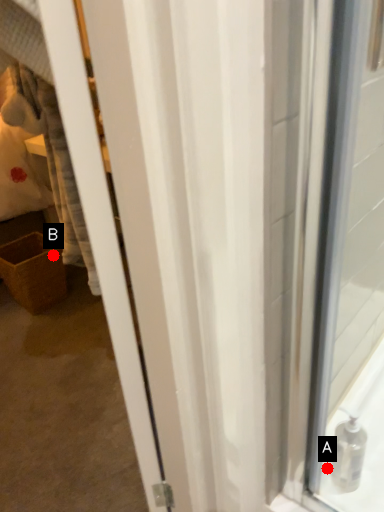
Question: Two points are circled on the image, labeled by A and B beside each circle. Among these points, which one is nearest to the camera?

Choices:
 (A) A is closer
 (B) B is closer

Answer: (A)